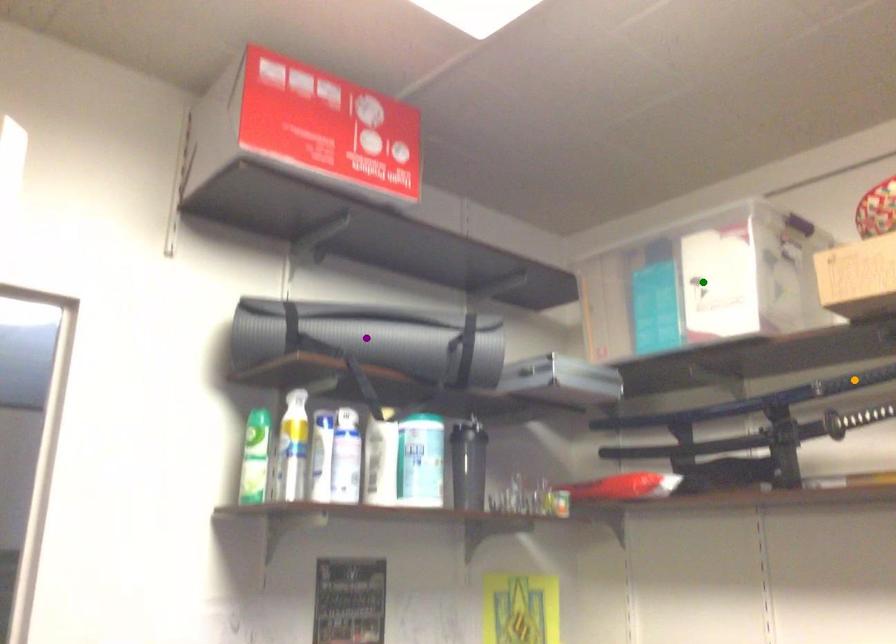
Order these from nearest to farthest:
purple point
orange point
green point

green point < purple point < orange point